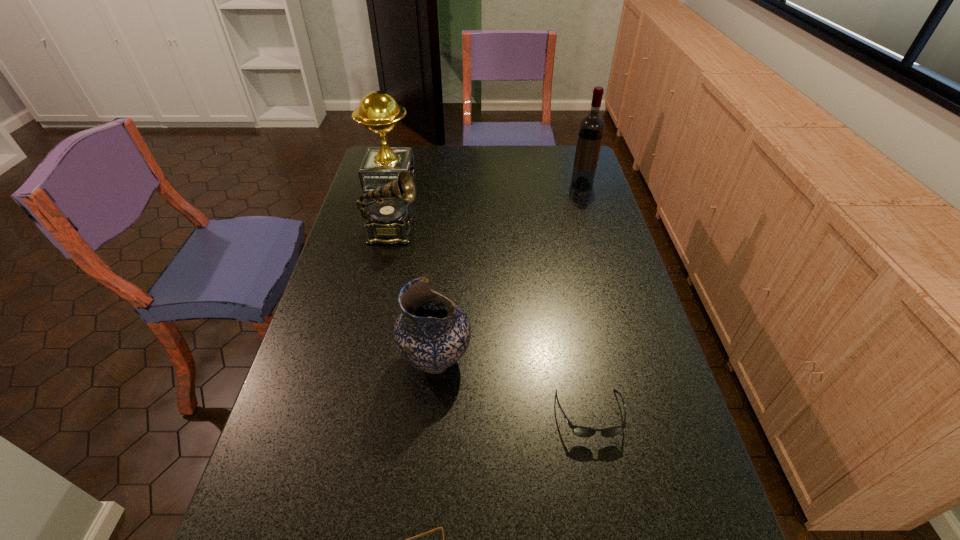
Where is `vacant region at the far left corner of the desktop`? This screenshot has height=540, width=960. vacant region at the far left corner of the desktop is located at coordinates (403, 145).

The width and height of the screenshot is (960, 540). What are the coordinates of `free space at the far right corner of the desktop` in the screenshot? It's located at (552, 145).

The height and width of the screenshot is (540, 960). Identify the location of unoccupied position between the pottery and the rightmost object. (509, 272).

You are a GUI agent. You are given a task and a screenshot of the screen. Output one action in this format:
    pyautogui.click(x=<x>, y=<y>)
    Task: Click on the free area in between the farther sunglasses and the award
    
    Given the screenshot: What is the action you would take?
    pyautogui.click(x=490, y=298)

Image resolution: width=960 pixels, height=540 pixels. What are the coordinates of `vacant space that's between the award and the taller sunglasses` in the screenshot? It's located at (490, 298).

What are the coordinates of `vacant point located between the fifth tallest object and the third farthest object` in the screenshot? It's located at (491, 323).

Locate an element on the screen. This screenshot has height=540, width=960. empty location between the wine bottle and the phonograph record is located at coordinates (487, 208).

Locate an element on the screen. The height and width of the screenshot is (540, 960). free space between the rightmost object and the fourth nearest object is located at coordinates (487, 208).

This screenshot has height=540, width=960. What are the coordinates of `free point between the award and the second object from right to left` in the screenshot? It's located at (490, 298).

You are a GUI agent. You are given a task and a screenshot of the screen. Output one action in this format:
    pyautogui.click(x=<x>, y=<y>)
    Task: Click on the free spot between the pottery and the award
    The height and width of the screenshot is (540, 960).
    Given the screenshot: What is the action you would take?
    pyautogui.click(x=413, y=269)